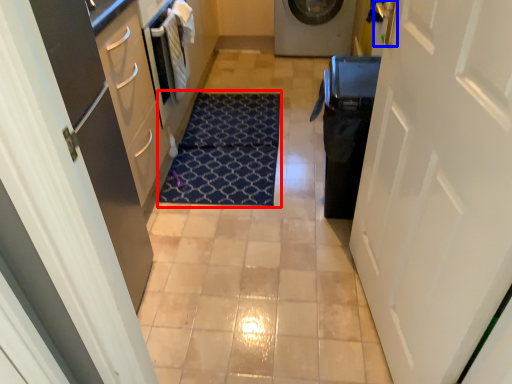
Question: Which object is closer to the camera taking this photo, doormat (highlighted by a red box) or door handle (highlighted by a blue box)?

Choices:
 (A) doormat
 (B) door handle

Answer: (B)